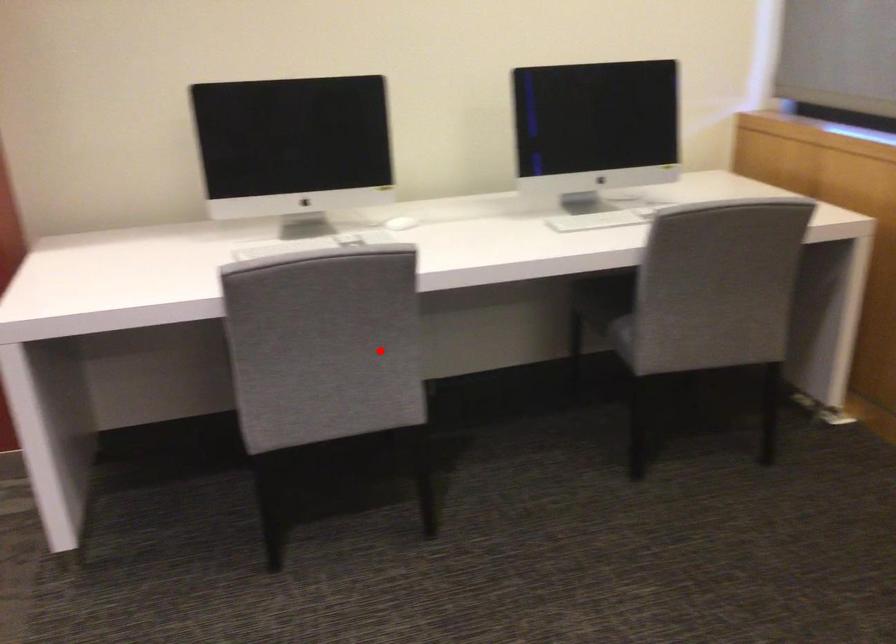
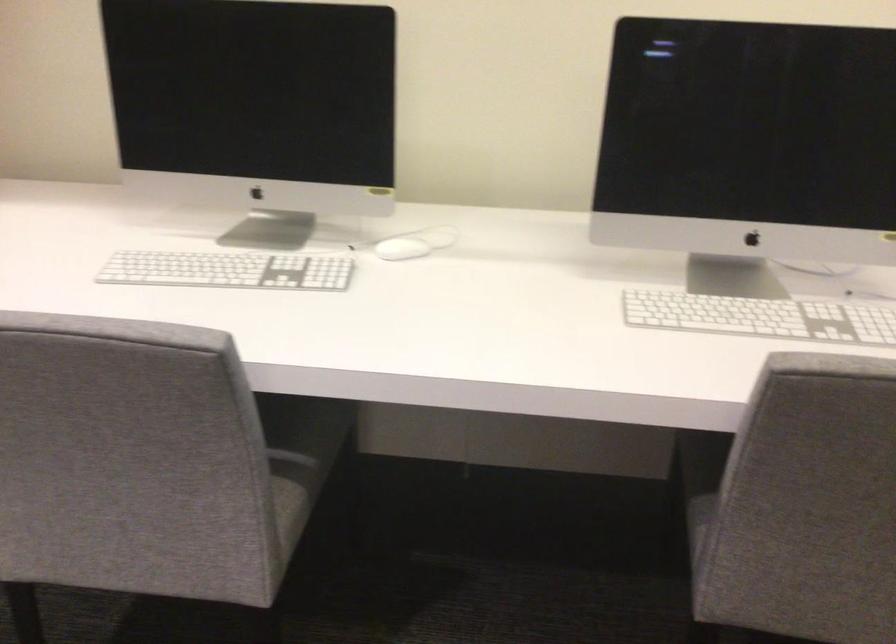
The point at the highlighted location is marked in the first image. Where is the corresponding point in the second image?

(291, 456)